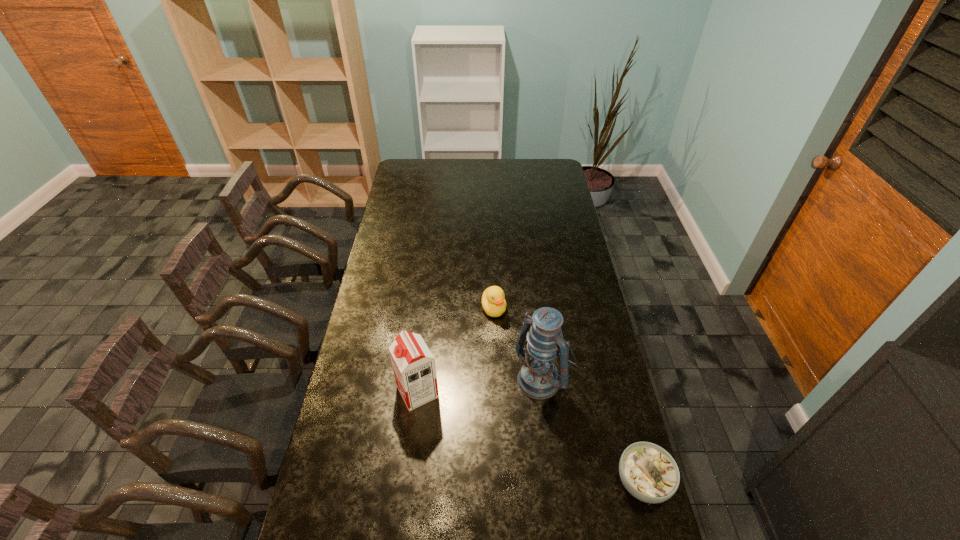
Find the location of a particular element. free space between the soup bowl and the third object from right to left is located at coordinates (568, 395).

At what (x,y) coordinates should I click in order to perform the action: click on unoccupied area between the second object from right to left and the shortest object. Please return your answer as a coordinate pair (x, y). The height and width of the screenshot is (540, 960). Looking at the image, I should click on (592, 429).

What are the coordinates of `blank region between the soya milk and the third object from right to left` in the screenshot? It's located at (456, 350).

Identify which object is the third closest to the leftmost object. Please provide its 2D coordinates. Your answer should be formatted as a tuple, i.e. [(x, y)], where the tuple contains the x and y coordinates of a point satisfying the conditions above.

[(648, 472)]

Locate an element on the screen. object that is the closest to the nearest object is located at coordinates (538, 378).

At what (x,y) coordinates should I click in order to perform the action: click on vacant space that satisfies the following two spatial constraints: 1. on the back side of the third object from left to right; 2. on the right side of the soya milk. Please return your answer as a coordinate pair (x, y). Looking at the image, I should click on (420, 376).

Find the location of a particular element. The height and width of the screenshot is (540, 960). vacant space that satisfies the following two spatial constraints: 1. on the front side of the soup bowl; 2. on the right side of the farthest object is located at coordinates (499, 482).